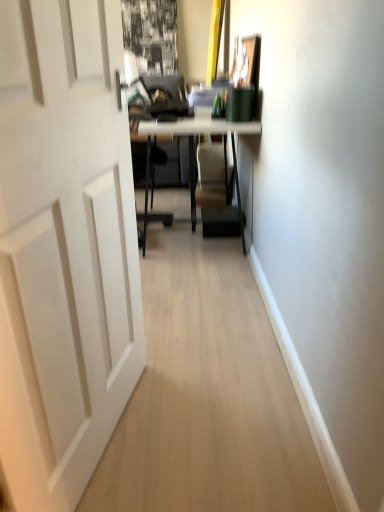
Question: Is matte white table at center a part of white matte door at left?

Choices:
 (A) no
 (B) yes

Answer: (A)

Question: From the image's perspective, is white matte door at left above matte white table at center?

Choices:
 (A) no
 (B) yes

Answer: (A)

Question: Can you confirm if white matte door at left is positioned to the right of matte white table at center?

Choices:
 (A) yes
 (B) no

Answer: (B)

Question: Can you confirm if white matte door at left is thinner than matte white table at center?

Choices:
 (A) no
 (B) yes

Answer: (B)

Question: From the image's perspective, would you say white matte door at left is shown under matte white table at center?

Choices:
 (A) no
 (B) yes

Answer: (B)

Question: Does white matte door at left have a greater height compared to matte white table at center?

Choices:
 (A) yes
 (B) no

Answer: (A)

Question: Is matte white table at center facing towards white matte door at left?

Choices:
 (A) yes
 (B) no

Answer: (B)

Question: Does matte white table at center have a lesser width compared to white matte door at left?

Choices:
 (A) yes
 (B) no

Answer: (B)

Question: Is matte white table at center to the right of white matte door at left from the viewer's perspective?

Choices:
 (A) no
 (B) yes

Answer: (B)

Question: Could white matte door at left be considered to be inside matte white table at center?

Choices:
 (A) no
 (B) yes

Answer: (A)

Question: Is the position of matte white table at center less distant than that of white matte door at left?

Choices:
 (A) yes
 (B) no

Answer: (B)

Question: Is matte white table at center with white matte door at left?

Choices:
 (A) no
 (B) yes

Answer: (A)

Question: From the image's perspective, relative to white matte door at left, is matte white table at center above or below?

Choices:
 (A) above
 (B) below

Answer: (A)